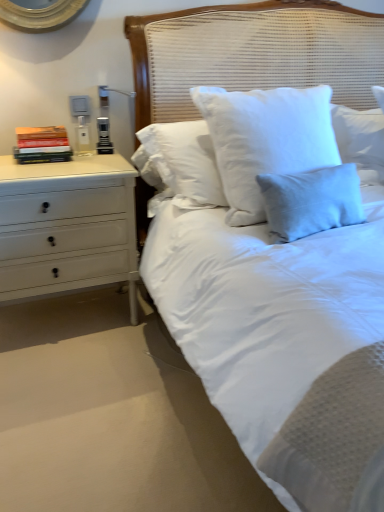
Question: Does white painted wood chest of drawers at left come in front of white woven headboard at center?

Choices:
 (A) yes
 (B) no

Answer: (B)

Question: Would you say white woven headboard at center is part of white painted wood chest of drawers at left's contents?

Choices:
 (A) no
 (B) yes

Answer: (A)

Question: From the image's perspective, is white painted wood chest of drawers at left over white woven headboard at center?

Choices:
 (A) yes
 (B) no

Answer: (B)

Question: Is white painted wood chest of drawers at left taller than white woven headboard at center?

Choices:
 (A) no
 (B) yes

Answer: (A)

Question: Does white painted wood chest of drawers at left have a larger size compared to white woven headboard at center?

Choices:
 (A) yes
 (B) no

Answer: (A)

Question: In terms of size, does white painted wood chest of drawers at left appear bigger or smaller than hardcover books at left?

Choices:
 (A) big
 (B) small

Answer: (A)

Question: From the image's perspective, is white painted wood chest of drawers at left above or below hardcover books at left?

Choices:
 (A) below
 (B) above

Answer: (A)

Question: Is white painted wood chest of drawers at left in front of or behind hardcover books at left in the image?

Choices:
 (A) behind
 (B) front

Answer: (B)

Question: Considering the positions of point (107, 156) and point (38, 157), is point (107, 156) closer or farther from the camera than point (38, 157)?

Choices:
 (A) closer
 (B) farther

Answer: (B)

Question: Is hardcover books at left wider or thinner than white woven headboard at center?

Choices:
 (A) wide
 (B) thin

Answer: (B)

Question: Does point (66, 147) appear closer or farther from the camera than point (302, 82)?

Choices:
 (A) farther
 (B) closer

Answer: (B)

Question: Considering the relative positions of hardcover books at left and white woven headboard at center in the image provided, is hardcover books at left to the left or to the right of white woven headboard at center?

Choices:
 (A) right
 (B) left

Answer: (B)

Question: From their relative heights in the image, would you say hardcover books at left is taller or shorter than white woven headboard at center?

Choices:
 (A) short
 (B) tall

Answer: (A)

Question: Does point (31, 152) appear closer or farther from the camera than point (82, 262)?

Choices:
 (A) closer
 (B) farther

Answer: (A)

Question: From their relative heights in the image, would you say hardcover books at left is taller or shorter than white painted wood chest of drawers at left?

Choices:
 (A) short
 (B) tall

Answer: (A)